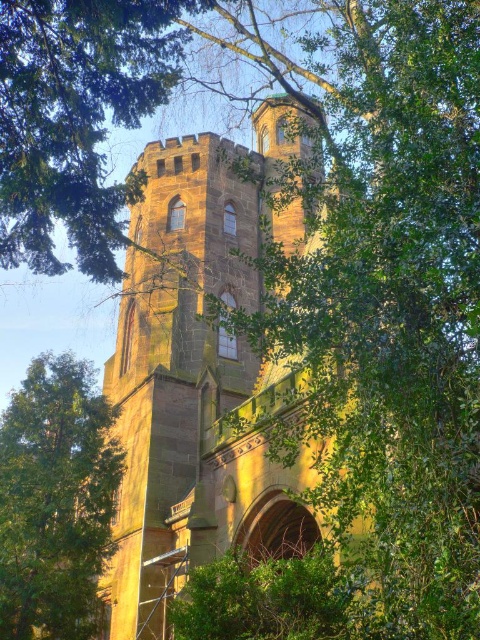
You are standing in front of the historic stone structure and want to determine the relative positions of two points marked on its facade. Which point, point (x=180, y=192) or point (x=20, y=573), is closer to you?

Point (x=180, y=192) is closer to you because it is further to the viewer than point (x=20, y=573).

You are standing in a field and see the brown stone church at center in the distance. If you want to reach the church, which direction should you walk relative to your current position?

Since the brown stone church at center is located at coordinates approximately 0.578 on the x axis and 0.421 on the y axis, you should walk towards the center of the image to reach it.

You are standing in front of the historic stone structure and want to take a photo that includes both the brown stone church at center and the green leafy tree at center. Which object should you position closer to the front of your photo frame to ensure both are in focus?

→ The brown stone church at center is closer to the viewer than the green leafy tree at center, so position the brown stone church at center closer to the front of your photo frame to ensure both are in focus.